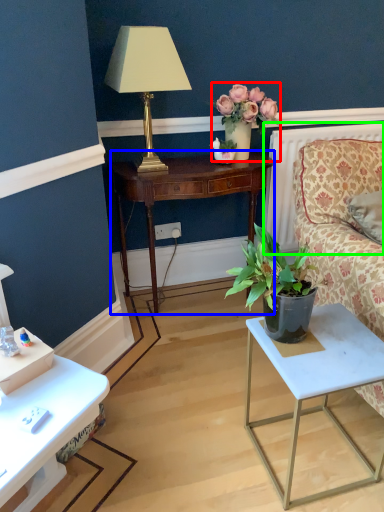
Question: Based on their relative distances, which object is farther from floral arrangement (highlighted by a red box)? Choose from nightstand (highlighted by a blue box) and radiator (highlighted by a green box).

Choices:
 (A) nightstand
 (B) radiator

Answer: (B)